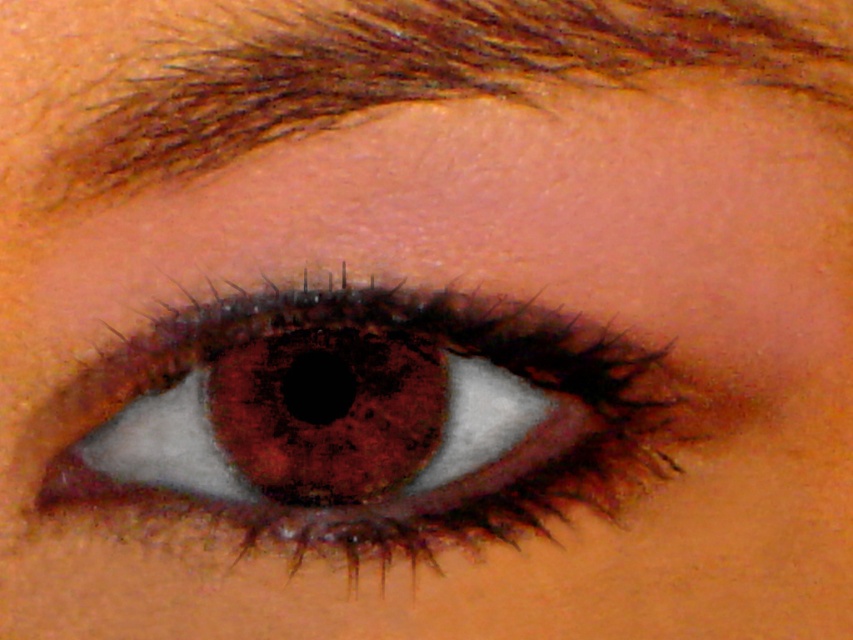
Who is lower down, brown matte eye at center or brown hair at upper center?

Positioned lower is brown matte eye at center.

Which of these two, brown matte eye at center or brown hair at upper center, stands shorter?

brown hair at upper center is shorter.

What do you see at coordinates (357, 422) in the screenshot? I see `brown matte eye at center` at bounding box center [357, 422].

At what (x,y) coordinates should I click in order to perform the action: click on brown matte eye at center. Please return your answer as a coordinate pair (x, y). This screenshot has height=640, width=853. Looking at the image, I should click on (357, 422).